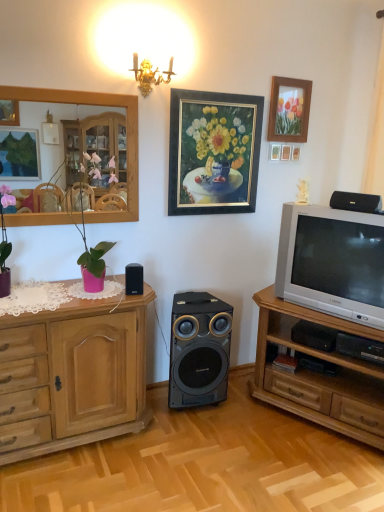
Question: Considering the positions of wooden picture frame at upper right, acting as the 2th picture frame starting from the left, and wooden mirror at upper left in the image, is wooden picture frame at upper right, acting as the 2th picture frame starting from the left, taller or shorter than wooden mirror at upper left?

Choices:
 (A) short
 (B) tall

Answer: (A)

Question: Is wooden picture frame at upper right, positioned as the 1th picture frame in right-to-left order, situated inside wooden mirror at upper left or outside?

Choices:
 (A) inside
 (B) outside

Answer: (B)

Question: Estimate the real-world distances between objects in this image. Which object is farther from the matte pink pot at left?

Choices:
 (A) black plastic speaker at upper right, which ranks as the third loudspeaker in bottom-to-top order
 (B) wooden cabinet at right
 (C) gold-framed painting at upper center, which is counted as the first picture frame, starting from the left
 (D) silver metallic television at right
 (E) wooden cabinet at left

Answer: (A)

Question: Which is farther from the black plastic speaker at center, the third loudspeaker in the front-to-back sequence?

Choices:
 (A) matte pink pot at left
 (B) wooden mirror at upper left
 (C) wooden cabinet at right
 (D) black plastic speaker at upper right, which ranks as the 1th loudspeaker in top-to-bottom order
 (E) silver metallic television at right

Answer: (B)